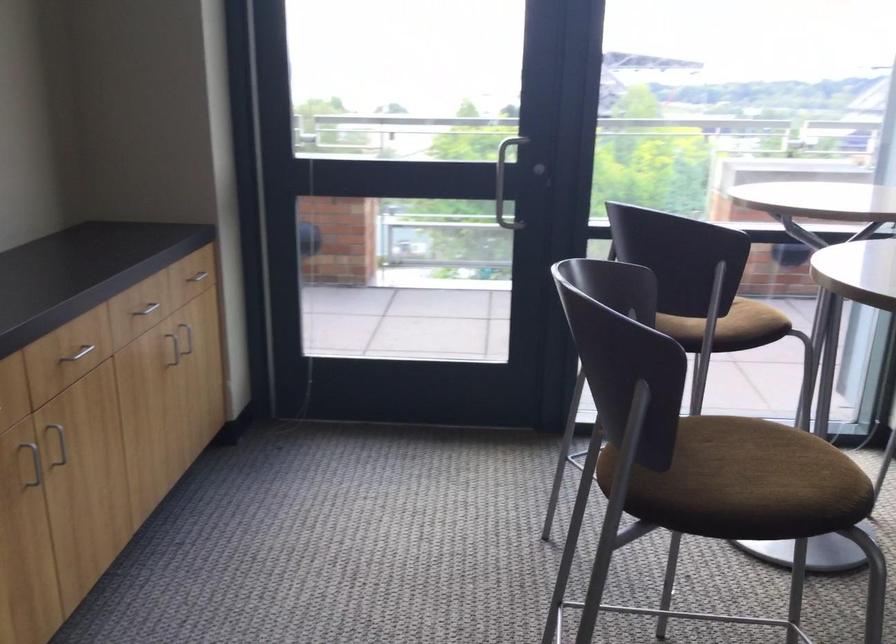
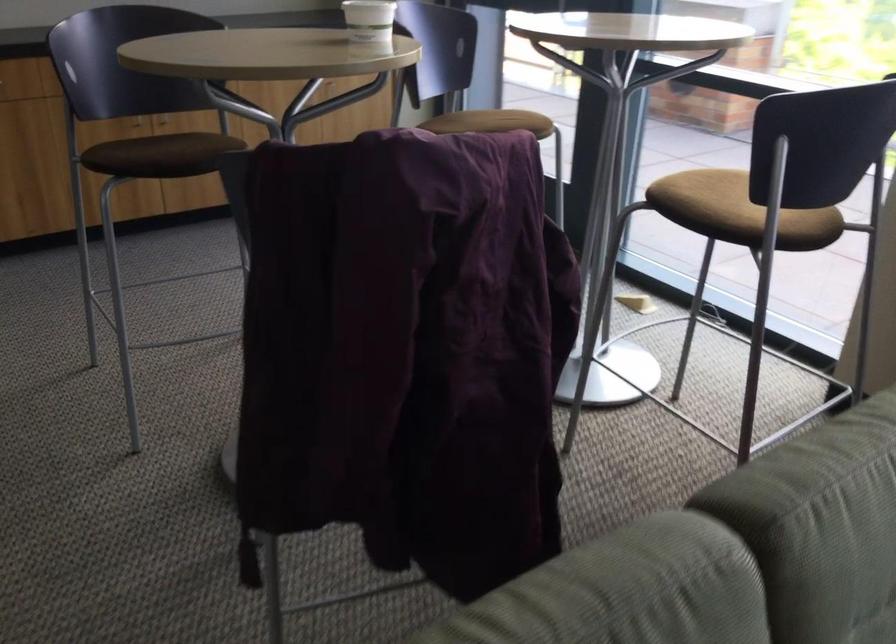
Question: I am providing you with two images of the same scene from different viewpoints. Please identify which objects are invisible in image2.

Choices:
 (A) patterned round stool
 (B) sofa armrest
 (C) white paper cup
 (D) silver cabinet handle

Answer: (D)